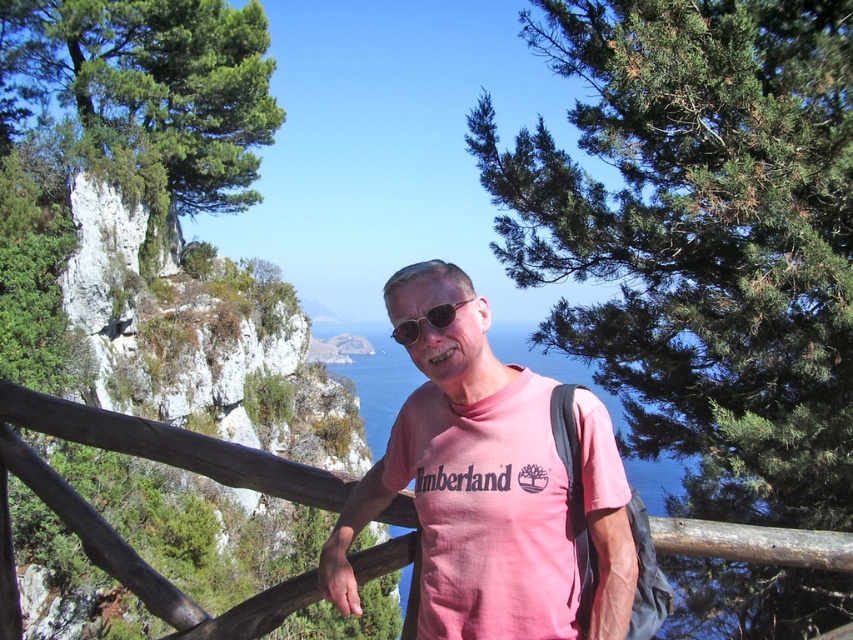
Question: Based on their relative distances, which object is farther from the sunglasses at center?

Choices:
 (A) pink cotton shirt at center
 (B) wooden at center
 (C) green needle-like pine at upper center

Answer: (C)

Question: Does green needle-like pine at upper center have a smaller size compared to wooden at center?

Choices:
 (A) no
 (B) yes

Answer: (A)

Question: Which of the following is the farthest from the observer?

Choices:
 (A) green needle-like pine at upper center
 (B) pink cotton shirt at center

Answer: (A)

Question: Can you confirm if green needle-like pine at upper center is positioned to the right of pink cotton shirt at center?

Choices:
 (A) no
 (B) yes

Answer: (B)

Question: Which point appears closest to the camera in this image?

Choices:
 (A) (480, 477)
 (B) (828, 554)
 (C) (790, 3)

Answer: (A)

Question: Is pink cotton shirt at center thinner than wooden at center?

Choices:
 (A) no
 (B) yes

Answer: (A)